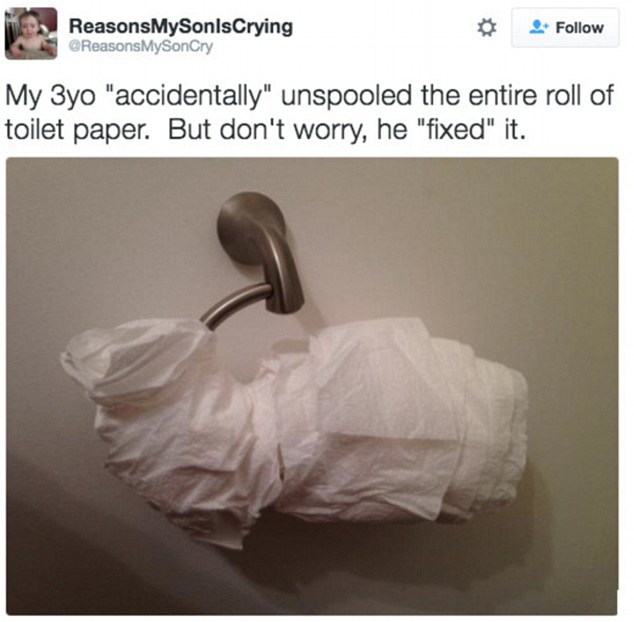
This screenshot has width=634, height=622. Find the location of `toilet tissue`. toilet tissue is located at coordinates (256, 452).